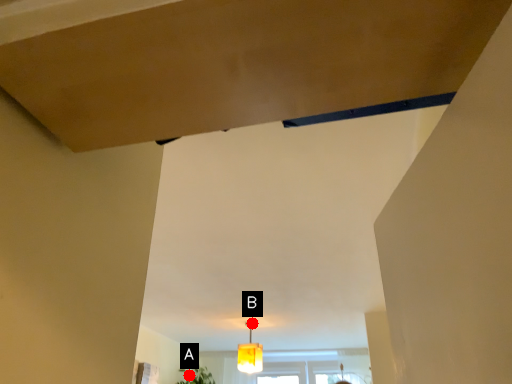
Question: Two points are circled on the image, labeled by A and B beside each circle. Which point is further to the camera?

Choices:
 (A) A is further
 (B) B is further

Answer: (A)